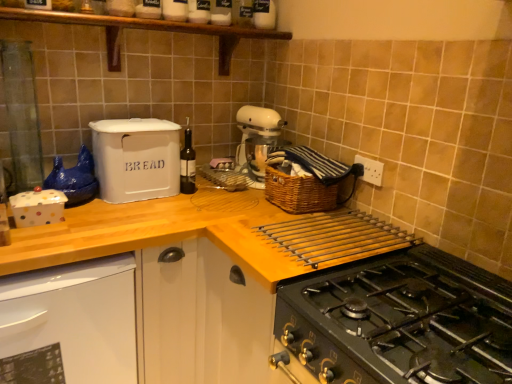
At what (x,y) coordinates should I click in order to perform the action: click on vacant space to the left of woven brown basket at upper right. Please return your answer as a coordinate pair (x, y). This screenshot has height=384, width=512. Looking at the image, I should click on (240, 206).